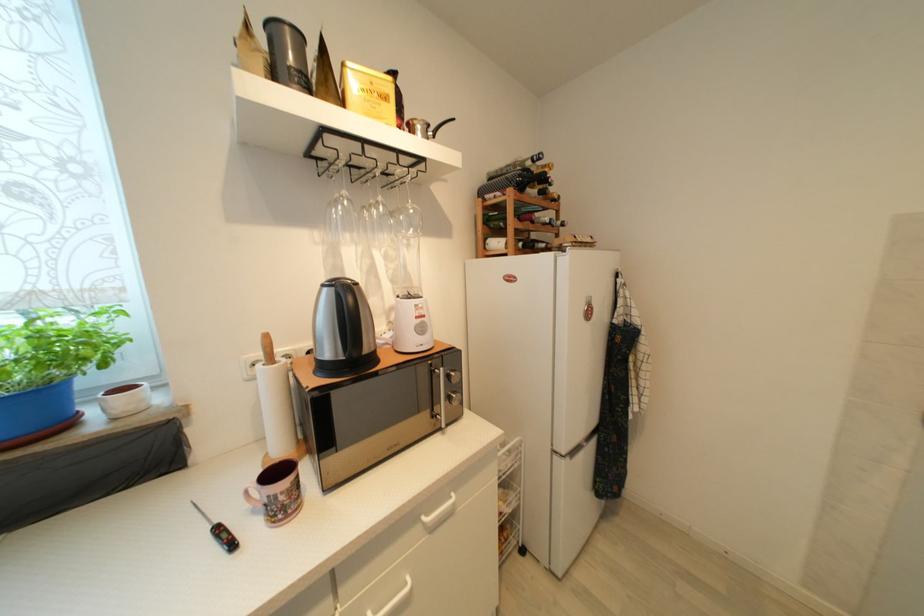
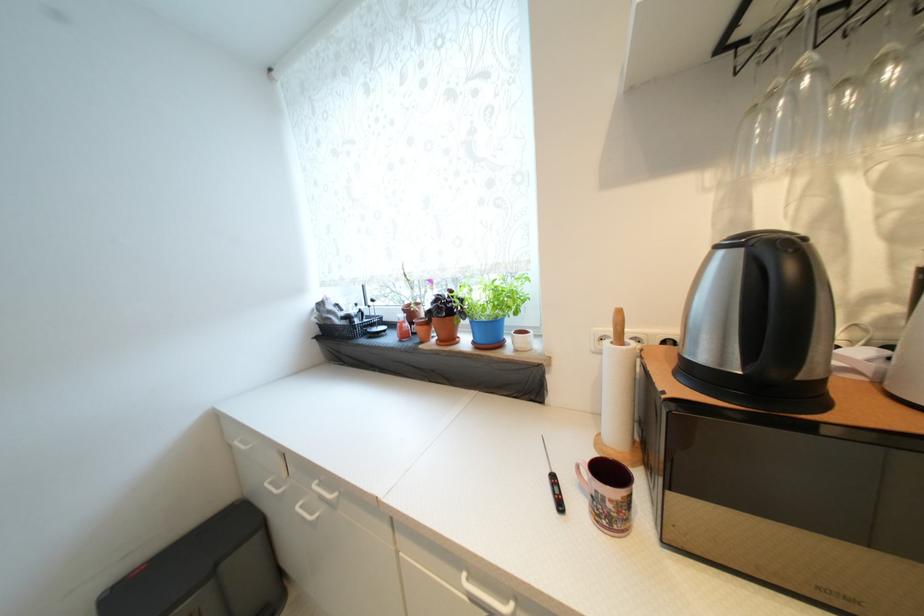
Where in the second image is the point corresponding to the point at 329,286 from the first image?

(723, 249)